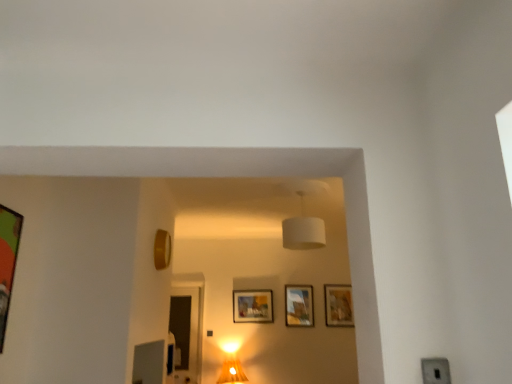
Question: Visually, is transparent glass door at center positioned to the left or to the right of matte gold table lamp at center?

Choices:
 (A) right
 (B) left

Answer: (B)

Question: From a real-world perspective, is transparent glass door at center above or below matte gold table lamp at center?

Choices:
 (A) above
 (B) below

Answer: (A)

Question: Considering the real-world distances, which object is closest to the wooden textured picture frame at right, the 1th picture frame viewed from the right?

Choices:
 (A) matte wooden picture frame at center, marked as the 3th picture frame in a front-to-back arrangement
 (B) gold metallic picture frame at upper center, which ranks as the 4th picture frame in back-to-front order
 (C) matte wooden picture frame at center, marked as the fourth picture frame in a front-to-back arrangement
 (D) green matte picture frame at left, arranged as the fifth picture frame when viewed from the right
 (E) transparent glass door at center

Answer: (C)

Question: Estimate the real-world distances between objects in this image. Which object is farther from the gold metallic picture frame at upper center, which ranks as the 4th picture frame in back-to-front order?

Choices:
 (A) matte gold table lamp at center
 (B) matte wooden picture frame at center, marked as the fourth picture frame in a front-to-back arrangement
 (C) white fabric lampshade at center
 (D) matte wooden picture frame at center, positioned as the 3th picture frame in right-to-left order
 (E) wooden textured picture frame at right, marked as the 5th picture frame in a left-to-right arrangement

Answer: (E)